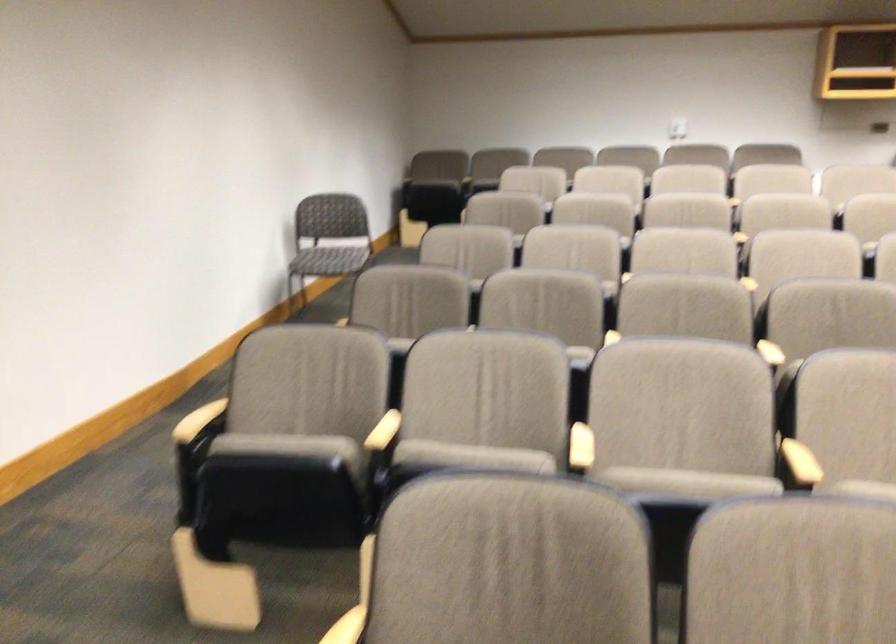
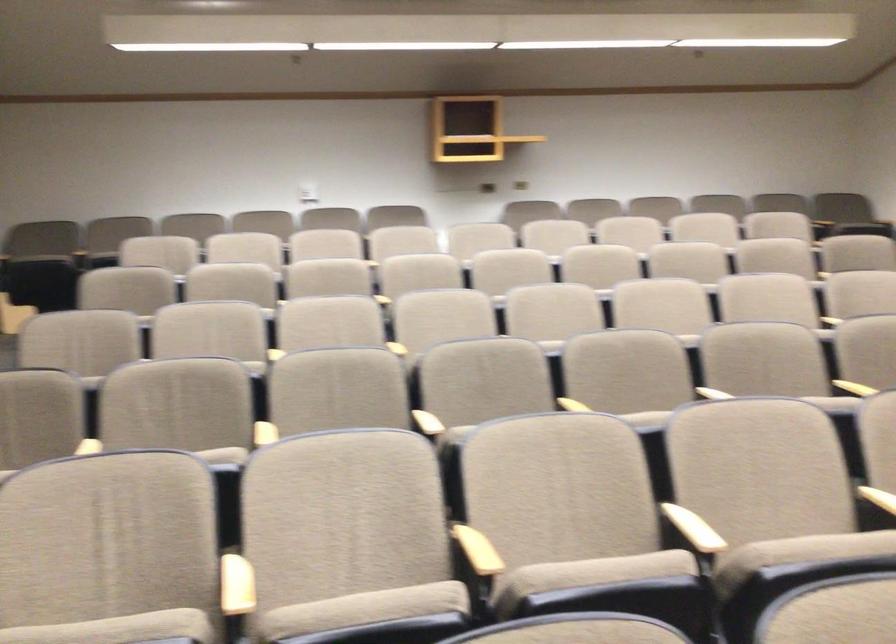
Where in the second image is the point corresponding to point (683, 480) from the first image?

(362, 609)